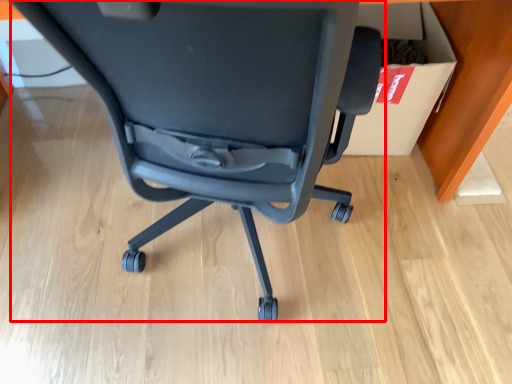
Question: From the image's perspective, where is chair (annotated by the red box) located relative to cardboard box?

Choices:
 (A) below
 (B) above

Answer: (A)